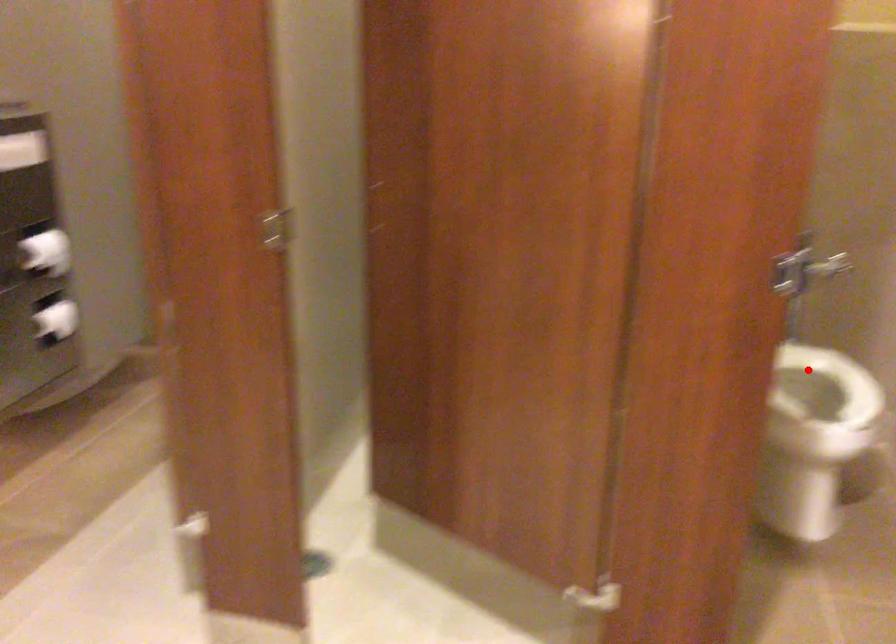
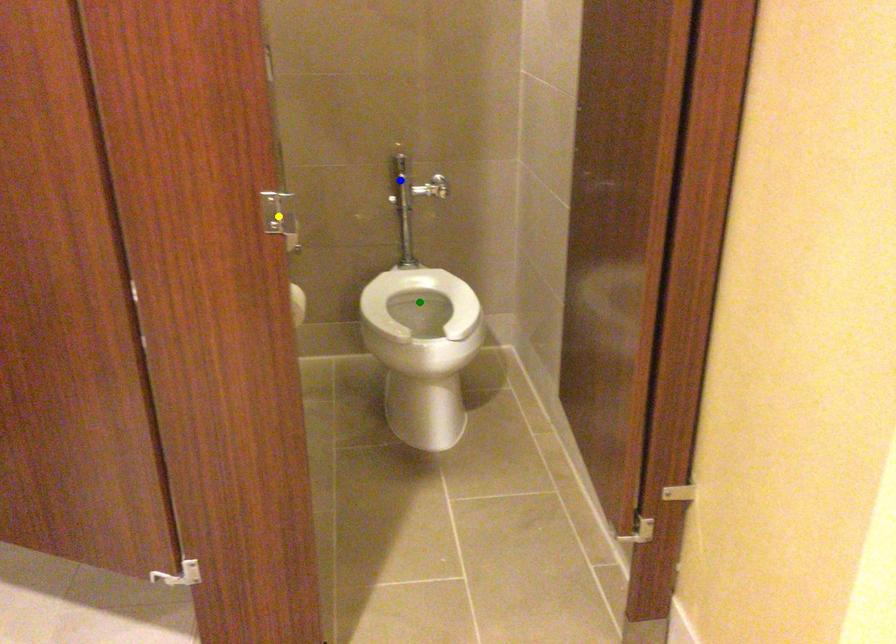
Question: I am providing you with two images of the same scene from different viewpoints. A red point is marked on the first image. You are given multiple points on the second image. Which point in image 2 represents the same 3d spot as the red point in image 1?

Choices:
 (A) blue point
 (B) green point
 (C) yellow point

Answer: (B)